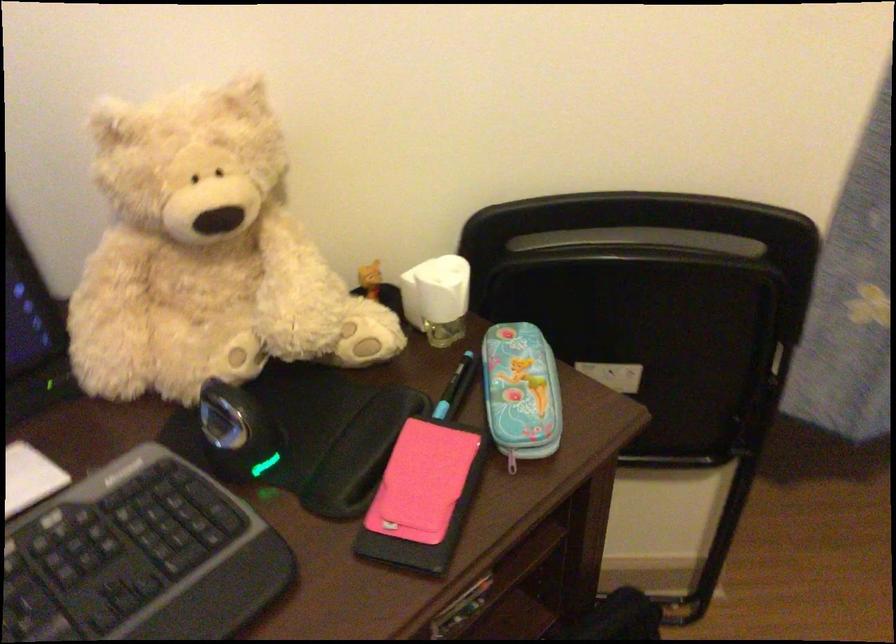
Where is `mouse scroll wheel`? This screenshot has height=644, width=896. mouse scroll wheel is located at coordinates (230, 402).